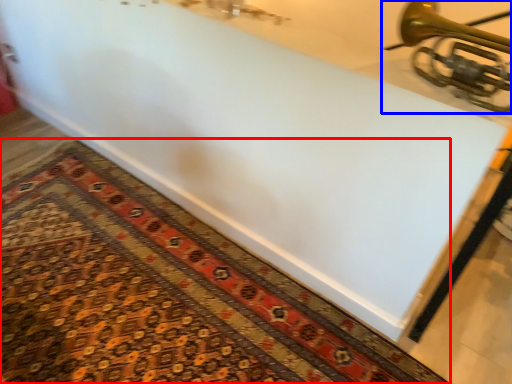
Question: Among these objects, which one is farthest to the camera, mat (highlighted by a red box) or musical instrument (highlighted by a blue box)?

Choices:
 (A) mat
 (B) musical instrument

Answer: (A)